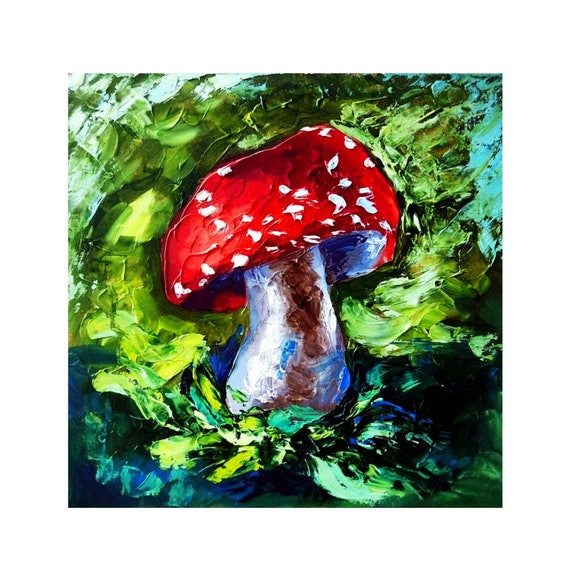
Where is `lower left corner of artwork`? This screenshot has height=570, width=570. lower left corner of artwork is located at coordinates (71, 503).